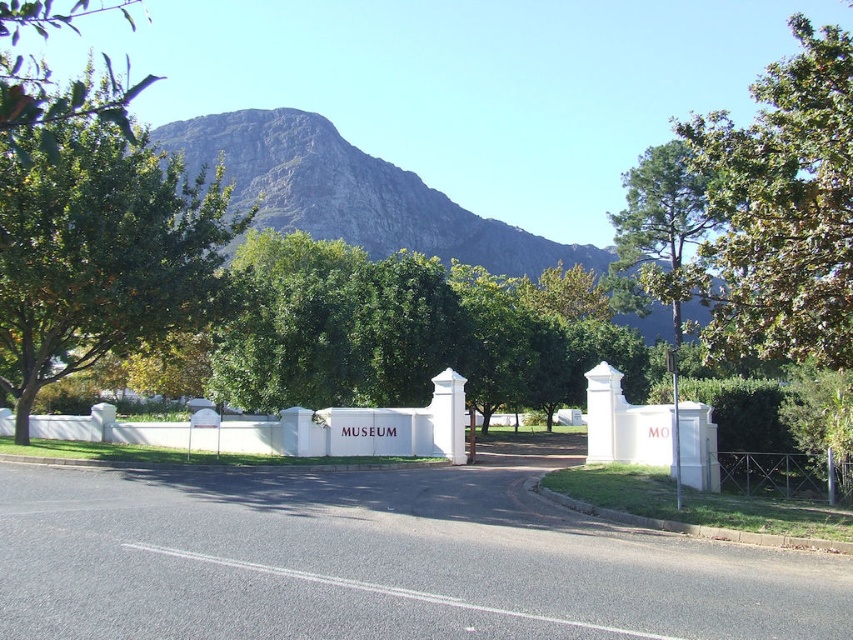
Between point (229, 195) and point (648, 276), which one is positioned behind?

The point (229, 195) is more distant.

Measure the distance between green leafy tree at upper left and green leafy tree at upper right.

The distance of green leafy tree at upper left from green leafy tree at upper right is 22.60 meters.

Who is more forward, (49, 228) or (647, 236)?

Point (49, 228) is in front.

The width and height of the screenshot is (853, 640). I want to click on green leafy tree at upper left, so click(x=99, y=250).

Is green leafy tree at upper left wider than metallic wire fence at right?

Correct, the width of green leafy tree at upper left exceeds that of metallic wire fence at right.

Does green leafy tree at upper left have a smaller size compared to metallic wire fence at right?

Incorrect, green leafy tree at upper left is not smaller in size than metallic wire fence at right.

I want to click on green leafy tree at upper left, so click(x=99, y=250).

This screenshot has width=853, height=640. I want to click on green leafy tree at upper left, so click(99, 250).

This screenshot has height=640, width=853. What do you see at coordinates (99, 250) in the screenshot?
I see `green leafy tree at upper left` at bounding box center [99, 250].

What do you see at coordinates (99, 250) in the screenshot?
I see `green leafy tree at upper left` at bounding box center [99, 250].

Locate an element on the screen. This screenshot has width=853, height=640. green leafy tree at upper left is located at coordinates (99, 250).